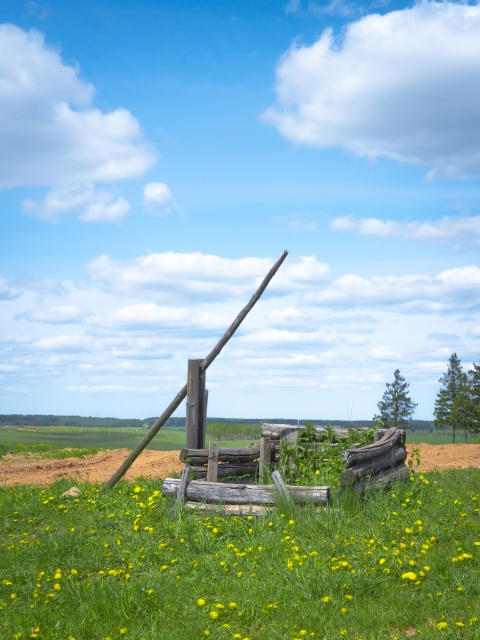
You are standing in the field and want to walk towards the weathered wood fence at center and the rustic wooden pole at center. Which object will you encounter first as you approach?

The weathered wood fence at center is in front of the rustic wooden pole at center, so you will encounter the weathered wood fence at center first.

You are standing at the well in the grassy field and want to walk towards the point labeled as point (216, 464). However, there is an obstacle at point (148, 436). Will you encounter the obstacle before reaching your destination?

Since point (216, 464) is in front of point (148, 436), you will reach the destination before encountering the obstacle at point (148, 436).